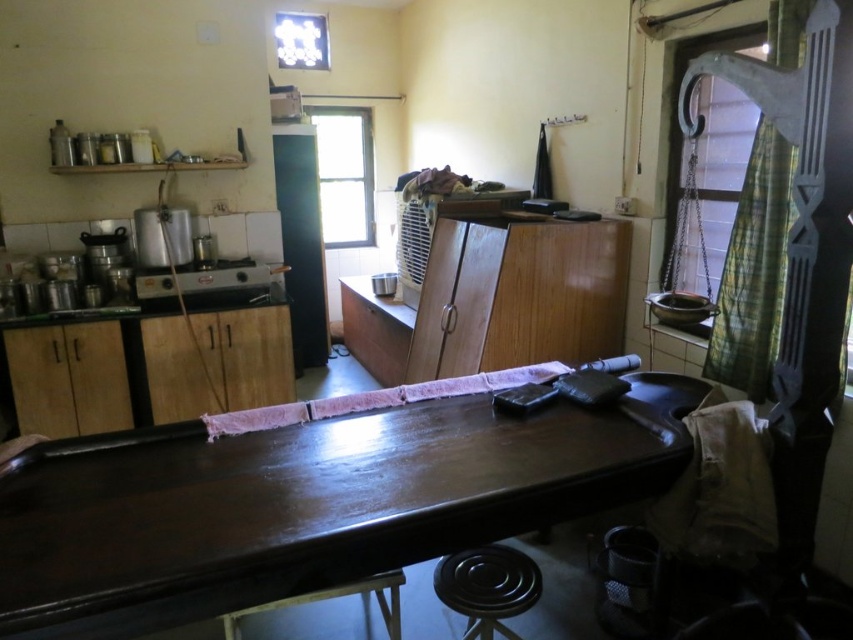
Between glossy wood table at center and metallic silver toaster at left, which one has less height?

metallic silver toaster at left is shorter.

Does glossy wood table at center have a lesser height compared to metallic silver toaster at left?

In fact, glossy wood table at center may be taller than metallic silver toaster at left.

Does point (447, 401) lie in front of point (198, 291)?

Yes.

The width and height of the screenshot is (853, 640). Identify the location of glossy wood table at center. (305, 508).

Is point (453, 596) in front of point (183, 284)?

Yes, it is in front of point (183, 284).

Looking at this image, is black rubber stool at lower center above metallic silver toaster at left?

No, black rubber stool at lower center is not above metallic silver toaster at left.

Between point (473, 582) and point (140, 275), which one is positioned behind?

The point (140, 275) is more distant.

The width and height of the screenshot is (853, 640). Find the location of `black rubber stool at lower center`. black rubber stool at lower center is located at coordinates (486, 588).

Who is positioned more to the left, black rubber stool at lower center or wooden stool at lower center?

From the viewer's perspective, wooden stool at lower center appears more on the left side.

Does black rubber stool at lower center appear on the left side of wooden stool at lower center?

No, black rubber stool at lower center is not to the left of wooden stool at lower center.

Locate an element on the screen. This screenshot has height=640, width=853. black rubber stool at lower center is located at coordinates (486, 588).